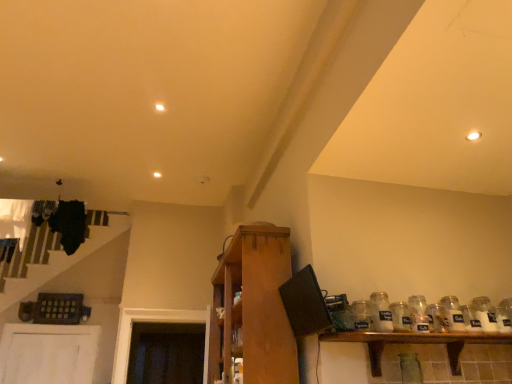
This screenshot has height=384, width=512. What are the coordinates of `clear glass jar at shelf right, which is the 1th glass jar from left to right` in the screenshot? It's located at (361, 315).

Locate an element on the screen. white glass jar at right, which is the 1th glass bottle from right to left is located at coordinates (485, 313).

What is the approximate width of clear glass jar at right, which is counted as the 2th glass bottle, starting from the left?

clear glass jar at right, which is counted as the 2th glass bottle, starting from the left, is 4.73 inches wide.

What is the approximate width of wooden shelf at lower right, the 1th shelf in the right-to-left sequence?

The width of wooden shelf at lower right, the 1th shelf in the right-to-left sequence, is 8.66 inches.

What is the approximate width of wooden cabinet at center, positioned as the second shelf in right-to-left order?

wooden cabinet at center, positioned as the second shelf in right-to-left order, is 23.22 inches wide.

Locate an element on the screen. The image size is (512, 384). white glass jar at right, marked as the fourth glass jar in a left-to-right arrangement is located at coordinates (505, 315).

Where is `clear glass jar at shelf right, which is the 4th glass jar in right-to-left order`? clear glass jar at shelf right, which is the 4th glass jar in right-to-left order is located at coordinates (361, 315).

In the scene shown: Considering the relative positions of clear glass jar at right, which is counted as the 2th glass bottle, starting from the left, and white glass jar at right, which is the 1th glass bottle from right to left, in the image provided, is clear glass jar at right, which is counted as the 2th glass bottle, starting from the left, to the right of white glass jar at right, which is the 1th glass bottle from right to left, from the viewer's perspective?

Incorrect, clear glass jar at right, which is counted as the 2th glass bottle, starting from the left, is not on the right side of white glass jar at right, which is the 1th glass bottle from right to left.

Are clear glass jar at right, which is counted as the 2th glass bottle, starting from the left, and white glass jar at right, which is the 1th glass bottle from right to left, beside each other?

No, clear glass jar at right, which is counted as the 2th glass bottle, starting from the left, is not making contact with white glass jar at right, which is the 1th glass bottle from right to left.

Is clear glass jar at right, placed as the second glass bottle when sorted from right to left, bigger or smaller than white glass jar at right, the third glass bottle from the left?

Considering their sizes, clear glass jar at right, placed as the second glass bottle when sorted from right to left, takes up more space than white glass jar at right, the third glass bottle from the left.

From a real-world perspective, is clear glass jar at right, which is counted as the 2th glass bottle, starting from the left, positioned under white glass jar at right, which is the 1th glass bottle from right to left, based on gravity?

Yes, from a real-world perspective, clear glass jar at right, which is counted as the 2th glass bottle, starting from the left, is under white glass jar at right, which is the 1th glass bottle from right to left.

Between white glass jar at right, the first glass jar positioned from the right, and white glass jar at right, the third glass bottle from the left, which one has less height?

With less height is white glass jar at right, the first glass jar positioned from the right.

Considering the sizes of white glass jar at right, the first glass jar positioned from the right, and white glass jar at right, the third glass bottle from the left, in the image, is white glass jar at right, the first glass jar positioned from the right, wider or thinner than white glass jar at right, the third glass bottle from the left,?

In the image, white glass jar at right, the first glass jar positioned from the right, appears to be more narrow than white glass jar at right, the third glass bottle from the left.

Which is closer to the camera, [507,303] or [476,303]?

Positioned in front is point [476,303].

Consider the image. Is white glass jar at right, the first glass jar positioned from the right, bigger or smaller than white glass jar at right, which is the 1th glass bottle from right to left?

Considering their sizes, white glass jar at right, the first glass jar positioned from the right, takes up less space than white glass jar at right, which is the 1th glass bottle from right to left.

Can you confirm if clear glass jar at right, the third glass jar positioned from the left, is positioned to the right of clear glass jar at right, placed as the second glass bottle when sorted from right to left?

Incorrect, clear glass jar at right, the third glass jar positioned from the left, is not on the right side of clear glass jar at right, placed as the second glass bottle when sorted from right to left.

In terms of size, does clear glass jar at right, the third glass jar positioned from the left, appear bigger or smaller than clear glass jar at right, placed as the second glass bottle when sorted from right to left?

In the image, clear glass jar at right, the third glass jar positioned from the left, appears to be smaller than clear glass jar at right, placed as the second glass bottle when sorted from right to left.

Would you say clear glass jar at right, placed as the second glass bottle when sorted from right to left, is part of clear glass jar at right, the third glass jar positioned from the left,'s contents?

No, clear glass jar at right, placed as the second glass bottle when sorted from right to left, is located outside of clear glass jar at right, the third glass jar positioned from the left.

Does clear glass jar at right, the third glass jar positioned from the left, turn towards clear glass jar at right, placed as the second glass bottle when sorted from right to left?

No.

Is white glass jar at right, the third glass bottle from the left, in contact with clear glass jar at right, the third glass jar positioned from the left?

No, white glass jar at right, the third glass bottle from the left, is not with clear glass jar at right, the third glass jar positioned from the left.

Where is `the 2nd glass bottle counting from the right side of the clear glass jar at right, the third glass jar positioned from the left`? Image resolution: width=512 pixels, height=384 pixels. the 2nd glass bottle counting from the right side of the clear glass jar at right, the third glass jar positioned from the left is located at coordinates (485, 313).

How different are the orientations of white glass jar at right, which is the 1th glass bottle from right to left, and clear glass jar at right, the third glass jar positioned from the left, in degrees?

white glass jar at right, which is the 1th glass bottle from right to left, and clear glass jar at right, the third glass jar positioned from the left, are facing 0.00118 degrees away from each other.

Is white glass jar at right, the third glass bottle from the left, inside the boundaries of clear glass jar at right, placed as the second glass jar when sorted from right to left, or outside?

white glass jar at right, the third glass bottle from the left, is not enclosed by clear glass jar at right, placed as the second glass jar when sorted from right to left.

Between point (444, 320) and point (425, 334), which one is positioned behind?

The point (444, 320) is behind.

Which of these two, clear glass jar at right, the third glass jar positioned from the left, or wooden shelf at lower right, the 2th shelf positioned from the left, stands taller?

Standing taller between the two is wooden shelf at lower right, the 2th shelf positioned from the left.

Measure the distance from clear glass jar at right, placed as the second glass jar when sorted from right to left, to wooden shelf at lower right, the 1th shelf in the right-to-left sequence.

The distance of clear glass jar at right, placed as the second glass jar when sorted from right to left, from wooden shelf at lower right, the 1th shelf in the right-to-left sequence, is 10.00 inches.

From a real-world perspective, which object rests below the other?

From a 3D spatial view, wooden shelf at lower right, the 1th shelf in the right-to-left sequence, is below.

Is point (391, 310) more distant than point (284, 273)?

That is False.

Can you tell me how much clear glass jar at right, which appears as the 3th glass jar when viewed from the right, and wooden cabinet at center, which ranks as the first shelf in left-to-right order, differ in facing direction?

91.7 degrees separate the facing orientations of clear glass jar at right, which appears as the 3th glass jar when viewed from the right, and wooden cabinet at center, which ranks as the first shelf in left-to-right order.

Is clear glass jar at right, the 2th glass jar viewed from the left, looking in the opposite direction of wooden cabinet at center, positioned as the second shelf in right-to-left order?

No, wooden cabinet at center, positioned as the second shelf in right-to-left order, is not at the back of clear glass jar at right, the 2th glass jar viewed from the left.

In the scene shown: Which object is positioned more to the left, clear glass jar at right, which appears as the 3th glass jar when viewed from the right, or wooden cabinet at center, positioned as the second shelf in right-to-left order?

wooden cabinet at center, positioned as the second shelf in right-to-left order, is more to the left.

Is clear glass jar at right, placed as the second glass jar when sorted from right to left, positioned with its back to clear glass jar at shelf right, which is the 4th glass jar in right-to-left order?

clear glass jar at right, placed as the second glass jar when sorted from right to left, is not turned away from clear glass jar at shelf right, which is the 4th glass jar in right-to-left order.

Between clear glass jar at right, the third glass jar positioned from the left, and clear glass jar at shelf right, which is the 1th glass jar from left to right, which one appears on the left side from the viewer's perspective?

Answer: From the viewer's perspective, clear glass jar at shelf right, which is the 1th glass jar from left to right, appears more on the left side.

From the image's perspective, which object appears higher, clear glass jar at right, the third glass jar positioned from the left, or clear glass jar at shelf right, which is the 1th glass jar from left to right?

clear glass jar at shelf right, which is the 1th glass jar from left to right, appears higher in the image.

What's the angular difference between clear glass jar at right, placed as the second glass jar when sorted from right to left, and clear glass jar at shelf right, which is the 1th glass jar from left to right,'s facing directions?

clear glass jar at right, placed as the second glass jar when sorted from right to left, and clear glass jar at shelf right, which is the 1th glass jar from left to right, are facing 0.000688 degrees away from each other.

The width and height of the screenshot is (512, 384). I want to click on glass bottle that appears above the clear glass jar at right, placed as the second glass bottle when sorted from right to left (from a real-world perspective), so click(485, 313).

This screenshot has width=512, height=384. I want to click on glass jar below the white glass jar at right, which is the 1th glass bottle from right to left (from the image's perspective), so click(x=505, y=315).

From the image, which object appears to be farther from wooden shelf at lower right, the 2th shelf positioned from the left, clear glass jar at right, the third glass jar positioned from the left, or white glass jar at right, marked as the fourth glass jar in a left-to-right arrangement?

white glass jar at right, marked as the fourth glass jar in a left-to-right arrangement, lies further to wooden shelf at lower right, the 2th shelf positioned from the left, than the other object.

In the scene shown: Estimate the real-world distances between objects in this image. Which object is closer to white glass jar at right, which is the 3th glass bottle in right-to-left order, clear glass jar at shelf right, which is the 4th glass jar in right-to-left order, or wooden cabinet at center, positioned as the second shelf in right-to-left order?

Based on the image, clear glass jar at shelf right, which is the 4th glass jar in right-to-left order, appears to be nearer to white glass jar at right, which is the 3th glass bottle in right-to-left order.

Looking at the image, which one is located closer to clear glass jar at shelf right, which is the 4th glass jar in right-to-left order, white glass jar at right, the first glass jar positioned from the right, or clear glass jar at right, placed as the second glass jar when sorted from right to left?

Among the two, clear glass jar at right, placed as the second glass jar when sorted from right to left, is located nearer to clear glass jar at shelf right, which is the 4th glass jar in right-to-left order.

Based on the photo, from the image, which object appears to be farther from white glass jar at right, which is the 1th glass bottle from right to left, wooden cabinet at center, which ranks as the first shelf in left-to-right order, or white glass jar at right, the first glass jar positioned from the right?

Based on the image, wooden cabinet at center, which ranks as the first shelf in left-to-right order, appears to be further to white glass jar at right, which is the 1th glass bottle from right to left.

Looking at the image, which one is located further to wooden cabinet at center, which ranks as the first shelf in left-to-right order, white glass jar at right, which is the 1th glass bottle from right to left, or clear glass jar at shelf right, which is the 4th glass jar in right-to-left order?

Among the two, white glass jar at right, which is the 1th glass bottle from right to left, is located further to wooden cabinet at center, which ranks as the first shelf in left-to-right order.

Looking at the image, which one is located further to clear glass jar at right, the third glass jar positioned from the left, clear glass jar at right, which is counted as the 2th glass bottle, starting from the left, or clear glass jar at shelf right, which is the 1th glass jar from left to right?

Among the two, clear glass jar at shelf right, which is the 1th glass jar from left to right, is located further to clear glass jar at right, the third glass jar positioned from the left.

Estimate the real-world distances between objects in this image. Which object is closer to white glass jar at right, marked as the 1th glass bottle in a left-to-right arrangement, wooden cabinet at center, positioned as the second shelf in right-to-left order, or white glass jar at right, the first glass jar positioned from the right?

white glass jar at right, the first glass jar positioned from the right, lies closer to white glass jar at right, marked as the 1th glass bottle in a left-to-right arrangement, than the other object.

Looking at the image, which one is located further to wooden shelf at lower right, the 2th shelf positioned from the left, clear glass jar at shelf right, which is the 4th glass jar in right-to-left order, or clear glass jar at right, the 2th glass jar viewed from the left?

Among the two, clear glass jar at shelf right, which is the 4th glass jar in right-to-left order, is located further to wooden shelf at lower right, the 2th shelf positioned from the left.

At what (x,y) coordinates should I click in order to perform the action: click on glass bottle between clear glass jar at shelf right, which is the 1th glass jar from left to right, and clear glass jar at right, the third glass jar positioned from the left, in the horizontal direction. Please return your answer as a coordinate pair (x, y). Image resolution: width=512 pixels, height=384 pixels. Looking at the image, I should click on (381, 312).

In order to click on glass jar situated between clear glass jar at right, the 2th glass jar viewed from the left, and white glass jar at right, the third glass bottle from the left, from left to right in this screenshot , I will do [x=437, y=318].

Identify the location of glass bottle located between wooden cabinet at center, which ranks as the first shelf in left-to-right order, and clear glass jar at right, which appears as the 3th glass jar when viewed from the right, in the left-right direction. The height and width of the screenshot is (384, 512). (381, 312).

Locate an element on the screen. The height and width of the screenshot is (384, 512). shelf located between clear glass jar at shelf right, which is the 1th glass jar from left to right, and clear glass jar at right, placed as the second glass bottle when sorted from right to left, in the left-right direction is located at coordinates (416, 343).